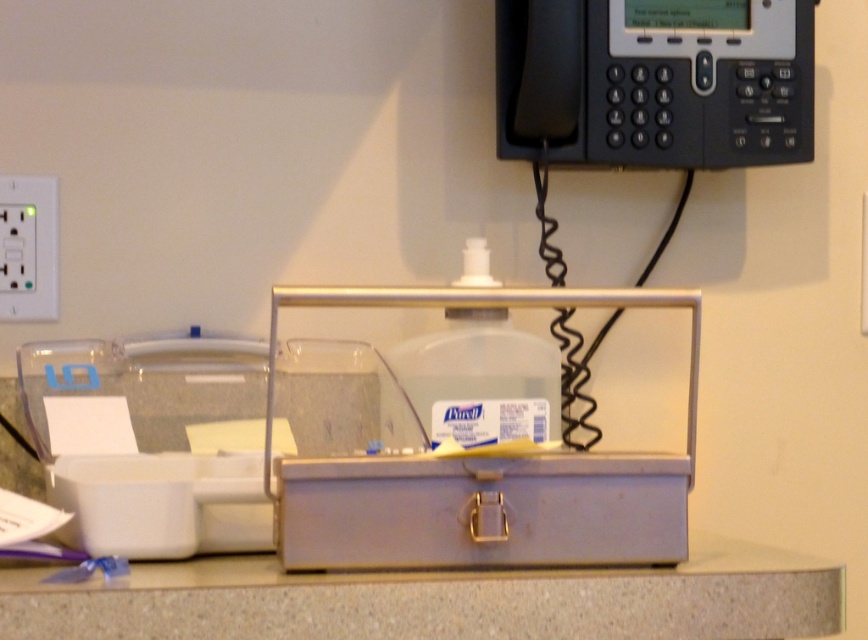
You are placing a new item on the gray matte counter top at center and want to ensure it doesn t interfere with the black plastic phone at upper right. What is the minimum distance you should keep between them?

The gray matte counter top at center is 19.78 inches away from the black plastic phone at upper right. To avoid interference, you should keep at least 19.78 inches between them.

You are arranging items on the gray matte counter top at center and need to place the black plastic phone at upper right. Based on the current setup, where should you position the phone relative to the counter top?

The gray matte counter top at center is in front of the black plastic phone at upper right, so you should position the phone behind the counter top to maintain the current spatial relationship.

You need to place a rectangular box that is 12 inches long on the gray matte counter top at center. Considering the counter top is wider than the black plastic phone at upper right, can the box fit horizontally on the counter top?

The gray matte counter top at center is wider than the black plastic phone at upper right. Since the box is 12 inches long, and the counter top has sufficient width, it should fit horizontally as long as the length of the counter top is at least 12 inches. However, the exact dimensions of the counter top aren